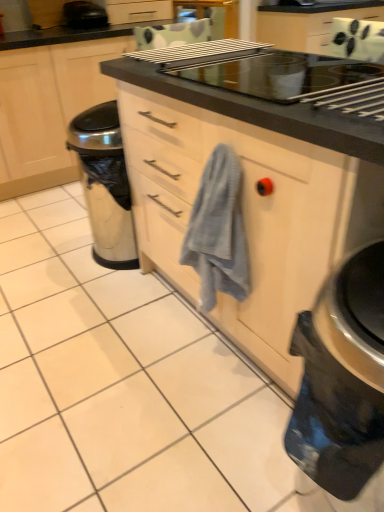
Find the location of `matte black cabinet at center`. matte black cabinet at center is located at coordinates (49, 100).

In the scene shown: Measure the distance between point (70, 16) and camera.

Point (70, 16) is 9.82 feet away from camera.

Describe the element at coordinates (84, 15) in the screenshot. This screenshot has width=384, height=512. I see `black plastic toaster at upper left` at that location.

The image size is (384, 512). Describe the element at coordinates (218, 231) in the screenshot. I see `gray textured towel at center` at that location.

Where is `matte black cabinet at center`? The height and width of the screenshot is (512, 384). matte black cabinet at center is located at coordinates (49, 100).

Is black plastic toaster at upper left at the left side of black glossy electric kettle at lower right?

Indeed, black plastic toaster at upper left is positioned on the left side of black glossy electric kettle at lower right.

How much distance is there between black plastic toaster at upper left and black glossy electric kettle at lower right?

A distance of 3.01 meters exists between black plastic toaster at upper left and black glossy electric kettle at lower right.

Who is shorter, black plastic toaster at upper left or black glossy electric kettle at lower right?

Standing shorter between the two is black plastic toaster at upper left.

Based on the photo, does black plastic toaster at upper left lie in front of black glossy electric kettle at lower right?

No, it is not.

Considering the positions of objects black glossy electric kettle at lower right and gray textured towel at center in the image provided, who is behind, black glossy electric kettle at lower right or gray textured towel at center?

gray textured towel at center is further away from the camera.

From the image's perspective, is black glossy electric kettle at lower right below gray textured towel at center?

Yes, from the image's perspective, black glossy electric kettle at lower right is beneath gray textured towel at center.

Which is less distant, (370,249) or (208,206)?

The point (370,249) is closer.

Between black glossy electric kettle at lower right and gray textured towel at center, which one has larger width?

With larger width is black glossy electric kettle at lower right.

Is matte black cabinet at center located outside gray textured towel at center?

matte black cabinet at center is positioned outside gray textured towel at center.

Who is more distant, matte black cabinet at center or gray textured towel at center?

matte black cabinet at center.

What are the coordinates of `bath towel above the matte black cabinet at center (from a real-world perspective)` in the screenshot? It's located at (218, 231).

Is matte black cabinet at center thinner than gray textured towel at center?

In fact, matte black cabinet at center might be wider than gray textured towel at center.

Is matte black cabinet at center inside the boundaries of black plastic toaster at upper left, or outside?

matte black cabinet at center is spatially situated outside black plastic toaster at upper left.

This screenshot has height=512, width=384. What are the coordinates of `kitchen appliance on the right of matte black cabinet at center` in the screenshot? It's located at (84, 15).

Is matte black cabinet at center facing away from black plastic toaster at upper left?

No, matte black cabinet at center is not facing the opposite direction of black plastic toaster at upper left.

Is gray textured towel at center next to black glossy electric kettle at lower right and touching it?

They are not placed beside each other.

Measure the distance between gray textured towel at center and black glossy electric kettle at lower right.

gray textured towel at center is 41.94 centimeters from black glossy electric kettle at lower right.

From the image's perspective, between gray textured towel at center and black glossy electric kettle at lower right, which one is located above?

gray textured towel at center appears higher in the image.

Considering the sizes of objects gray textured towel at center and black glossy electric kettle at lower right in the image provided, who is thinner, gray textured towel at center or black glossy electric kettle at lower right?

With smaller width is gray textured towel at center.

Is black plastic toaster at upper left touching matte black cabinet at center?

No, black plastic toaster at upper left is not next to matte black cabinet at center.

From a real-world perspective, who is located higher, black plastic toaster at upper left or matte black cabinet at center?

black plastic toaster at upper left.

Locate an element on the screen. cabinetry that appears below the black plastic toaster at upper left (from the image's perspective) is located at coordinates (49, 100).

Does point (78, 3) come behind point (20, 146)?

Yes, it is.

Considering the relative sizes of black plastic toaster at upper left and gray textured towel at center in the image provided, is black plastic toaster at upper left smaller than gray textured towel at center?

No, black plastic toaster at upper left is not smaller than gray textured towel at center.

Is point (81, 11) positioned before point (210, 238)?

No, it is behind (210, 238).

Based on the photo, from a real-world perspective, is black plastic toaster at upper left physically below gray textured towel at center?

No, from a real-world perspective, black plastic toaster at upper left is not beneath gray textured towel at center.

This screenshot has height=512, width=384. What are the coordinates of `kitchen appliance above the black glossy electric kettle at lower right (from the image's perspective)` in the screenshot? It's located at (84, 15).

At what (x,y) coordinates should I click in order to perform the action: click on home appliance in front of the gray textured towel at center. Please return your answer as a coordinate pair (x, y). This screenshot has width=384, height=512. Looking at the image, I should click on (342, 378).

When comparing their distances from black glossy electric kettle at lower right, does black plastic toaster at upper left or gray textured towel at center seem further?

Among the two, black plastic toaster at upper left is located further to black glossy electric kettle at lower right.

Based on their spatial positions, is matte black cabinet at center or gray textured towel at center further from black plastic toaster at upper left?

gray textured towel at center is further to black plastic toaster at upper left.

When comparing their distances from matte black cabinet at center, does black plastic toaster at upper left or gray textured towel at center seem further?

gray textured towel at center is positioned further to the anchor matte black cabinet at center.

Based on their spatial positions, is black glossy electric kettle at lower right or matte black cabinet at center further from black plastic toaster at upper left?

black glossy electric kettle at lower right is positioned further to the anchor black plastic toaster at upper left.

Looking at the image, which one is located closer to black plastic toaster at upper left, gray textured towel at center or black glossy electric kettle at lower right?

The object closer to black plastic toaster at upper left is gray textured towel at center.

Considering their positions, is black glossy electric kettle at lower right positioned closer to matte black cabinet at center than black plastic toaster at upper left?

black plastic toaster at upper left.

From the image, which object appears to be nearer to matte black cabinet at center, black plastic toaster at upper left or black glossy electric kettle at lower right?

Based on the image, black plastic toaster at upper left appears to be nearer to matte black cabinet at center.

Consider the image. Which object lies further to the anchor point gray textured towel at center, matte black cabinet at center or black glossy electric kettle at lower right?

Based on the image, matte black cabinet at center appears to be further to gray textured towel at center.

The height and width of the screenshot is (512, 384). Identify the location of bath towel between black glossy electric kettle at lower right and matte black cabinet at center along the z-axis. (218, 231).

You are a GUI agent. You are given a task and a screenshot of the screen. Output one action in this format:
    pyautogui.click(x=<x>, y=<y>)
    Task: Click on the cabinetry positioned between gray textured towel at center and black plastic toaster at upper left from near to far
    This screenshot has height=512, width=384.
    Given the screenshot: What is the action you would take?
    pyautogui.click(x=49, y=100)

Where is `cabinetry between black glossy electric kettle at lower right and black plastic toaster at upper left in the front-back direction`? This screenshot has height=512, width=384. cabinetry between black glossy electric kettle at lower right and black plastic toaster at upper left in the front-back direction is located at coordinates (49, 100).

Where is `bath towel between black glossy electric kettle at lower right and black plastic toaster at upper left in the front-back direction`? The height and width of the screenshot is (512, 384). bath towel between black glossy electric kettle at lower right and black plastic toaster at upper left in the front-back direction is located at coordinates (218, 231).